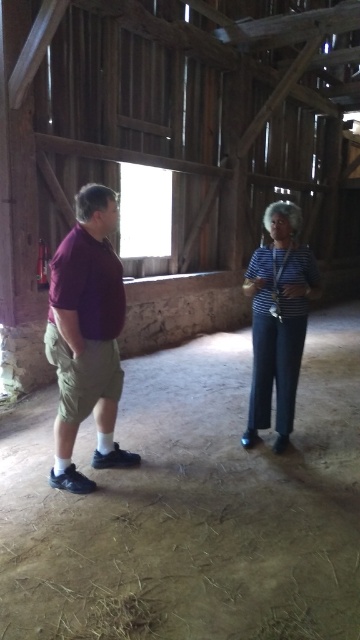
The height and width of the screenshot is (640, 360). What do you see at coordinates (87, 337) in the screenshot?
I see `maroon fabric shirt at left` at bounding box center [87, 337].

Is maroon fabric shirt at left smaller than striped fabric shirt at center?

Incorrect, maroon fabric shirt at left is not smaller in size than striped fabric shirt at center.

This screenshot has width=360, height=640. I want to click on maroon fabric shirt at left, so click(87, 337).

This screenshot has width=360, height=640. I want to click on maroon fabric shirt at left, so click(87, 337).

Does point (51, 344) come in front of point (254, 259)?

Yes, point (51, 344) is closer to viewer.

Who is lower down, matte purple shirt at left or striped fabric shirt at center?

matte purple shirt at left is lower down.

Who is more forward, (96, 214) or (284, 236)?

Point (96, 214)

The image size is (360, 640). In order to click on matte purple shirt at left in this screenshot , I will do `click(87, 337)`.

How much distance is there between maroon fabric shirt at left and matte purple shirt at left?

maroon fabric shirt at left is 0.60 inches away from matte purple shirt at left.

At what (x,y) coordinates should I click in order to perform the action: click on maroon fabric shirt at left. Please return your answer as a coordinate pair (x, y). The width and height of the screenshot is (360, 640). Looking at the image, I should click on (87, 337).